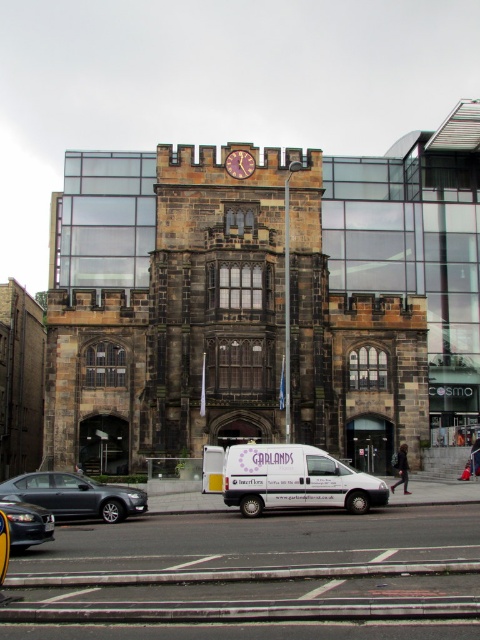
Who is higher up, white matte van at center or shiny black car at lower left?

white matte van at center

Is point (377, 506) positioned in front of point (36, 529)?

No, (377, 506) is behind (36, 529).

This screenshot has width=480, height=640. What do you see at coordinates (296, 481) in the screenshot?
I see `white matte van at center` at bounding box center [296, 481].

Find the location of a particular element. white matte van at center is located at coordinates (296, 481).

Is white matte van at center further to the viewer compared to metallic gray sedan at lower left?

Yes.

Does point (288, 474) come closer to viewer compared to point (104, 502)?

That is False.

Between point (342, 493) and point (67, 492), which one is positioned in front?

Point (67, 492) is in front.

You are a GUI agent. You are given a task and a screenshot of the screen. Output one action in this format:
    pyautogui.click(x=<x>, y=<y>)
    Task: Click on the white matte van at center
    Image resolution: width=480 pixels, height=640 pixels.
    Given the screenshot: What is the action you would take?
    pyautogui.click(x=296, y=481)

Which is in front, point (44, 481) or point (25, 512)?

Point (25, 512)

Looking at this image, is metallic gray sedan at lower left below shiny black car at lower left?

Yes, metallic gray sedan at lower left is below shiny black car at lower left.

The height and width of the screenshot is (640, 480). I want to click on metallic gray sedan at lower left, so click(x=74, y=496).